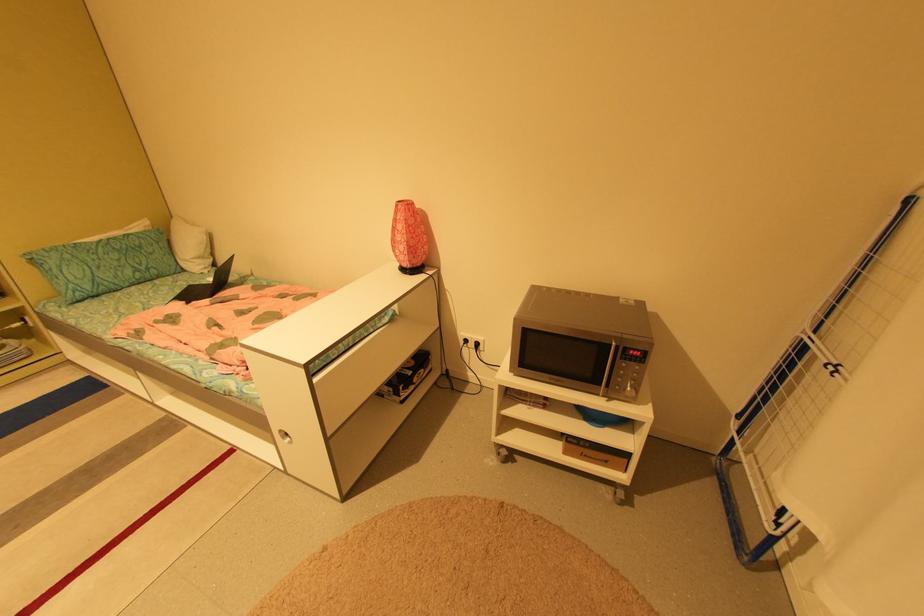
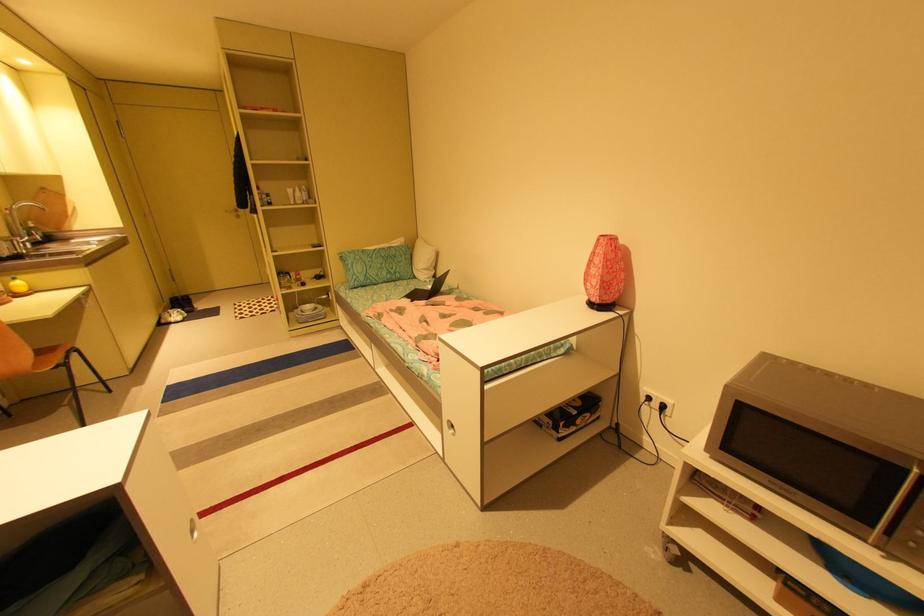
Find the pixel in the second image that matches point 406,201 in the first image.

(608, 236)